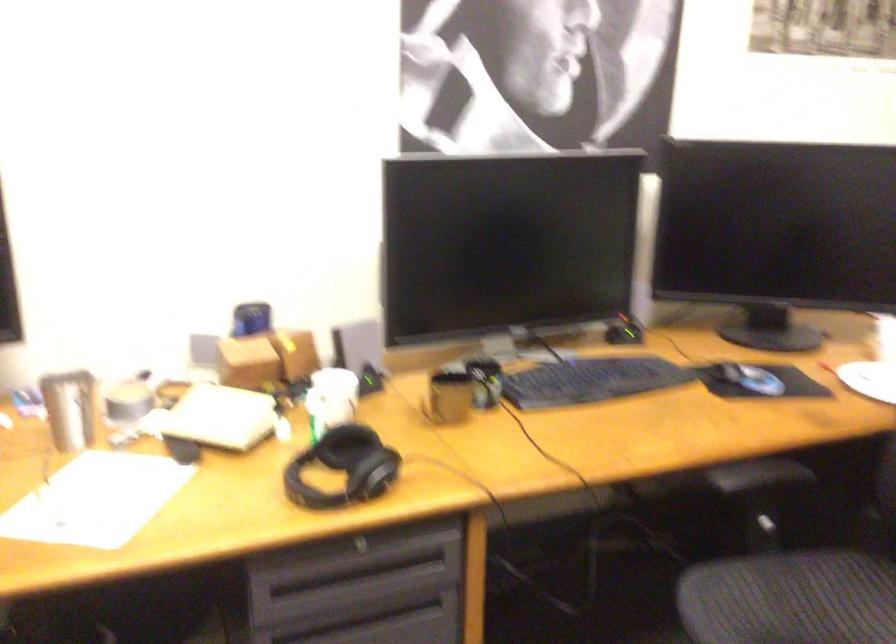
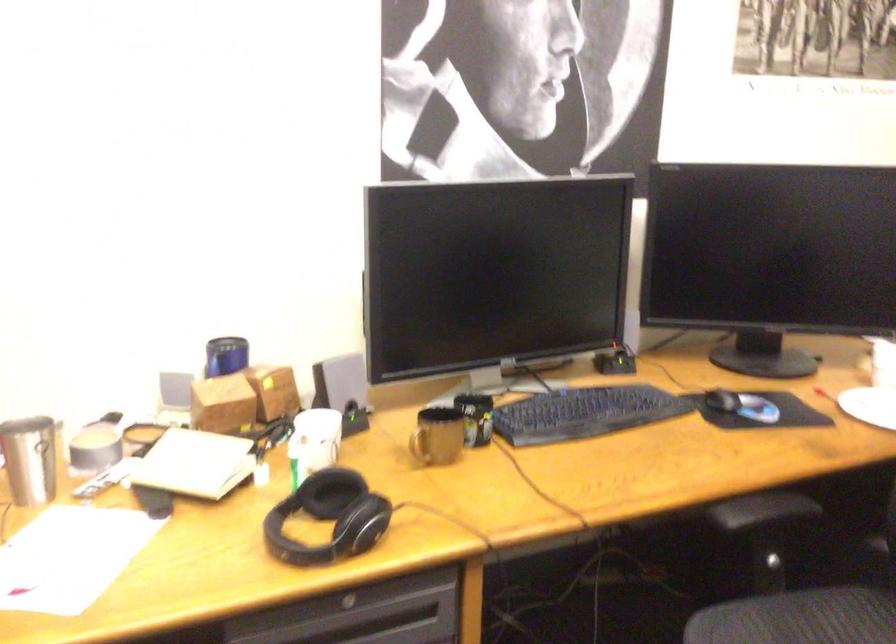
Question: The first image is from the beginning of the video and the second image is from the end. How did the camera likely rotate when shooting the video?

Choices:
 (A) Left
 (B) Right
 (C) Up
 (D) Down

Answer: (B)